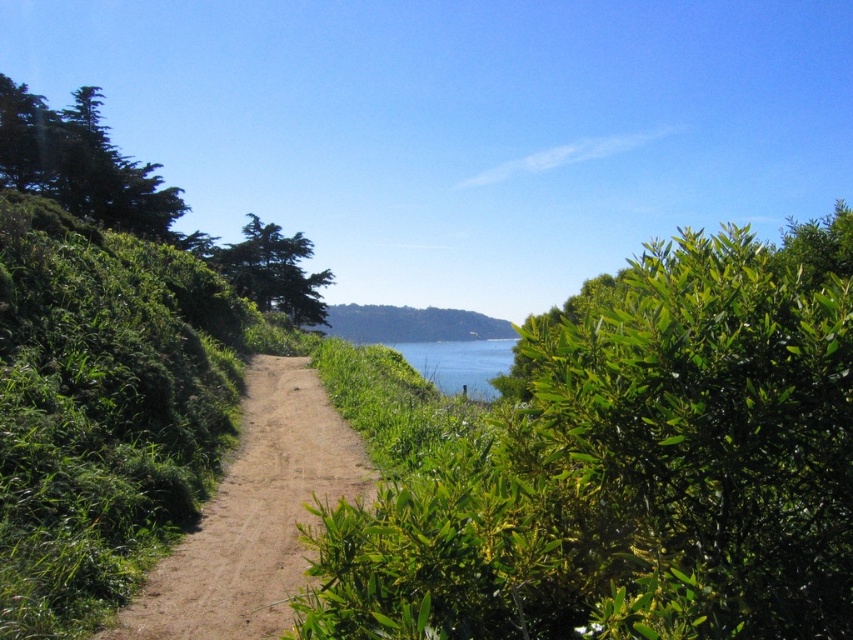
Consider the image. Can you confirm if green leafy bush at center is positioned above green textured tree at upper center?

Incorrect, green leafy bush at center is not positioned above green textured tree at upper center.

Is point (799, 611) positioned behind point (267, 250)?

No, it is in front of (267, 250).

Image resolution: width=853 pixels, height=640 pixels. What do you see at coordinates (616, 464) in the screenshot? I see `green leafy bush at center` at bounding box center [616, 464].

This screenshot has width=853, height=640. I want to click on green leafy bush at center, so 616,464.

Which is more to the left, green leafy tree at upper left or green textured tree at upper center?

green leafy tree at upper left is more to the left.

Is point (86, 116) in front of point (270, 289)?

Yes, point (86, 116) is in front of point (270, 289).

Describe the element at coordinates (80, 163) in the screenshot. The height and width of the screenshot is (640, 853). I see `green leafy tree at upper left` at that location.

Where is `green leafy tree at upper left`? green leafy tree at upper left is located at coordinates (80, 163).

Is green textured tree at upper center thinner than blue water at center?

Yes.

Who is more distant from viewer, (289, 262) or (457, 376)?

Point (457, 376)

Which is behind, point (263, 282) or point (480, 346)?

Positioned behind is point (480, 346).

This screenshot has width=853, height=640. Find the location of `green textured tree at upper center`. green textured tree at upper center is located at coordinates (274, 273).